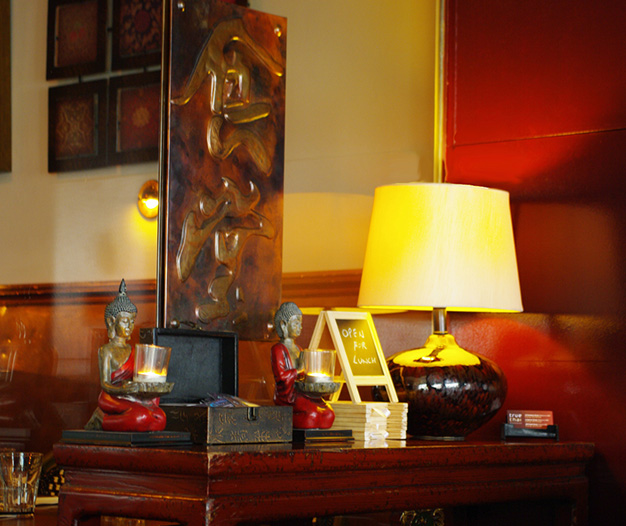
The height and width of the screenshot is (526, 626). Find the location of `wall art`. wall art is located at coordinates pyautogui.click(x=244, y=150), pyautogui.click(x=121, y=118), pyautogui.click(x=84, y=120), pyautogui.click(x=135, y=26), pyautogui.click(x=95, y=28), pyautogui.click(x=8, y=100).